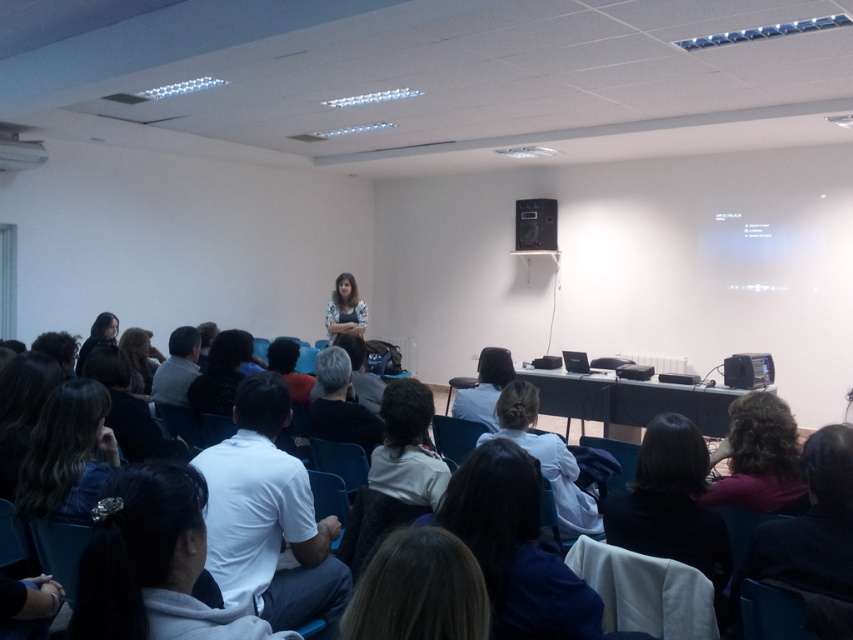
Question: Where is white matte shirt at center located in relation to gray fabric shirt at center in the image?

Choices:
 (A) below
 (B) above

Answer: (A)

Question: Which object appears farthest from the camera in this image?

Choices:
 (A) dark brown hair at lower right
 (B) smooth white shirt at center

Answer: (B)

Question: Does white cotton shirt at center appear over matte black jacket at left?

Choices:
 (A) no
 (B) yes

Answer: (A)

Question: Is gray fabric shirt at center wider than black plastic speaker at upper center?

Choices:
 (A) yes
 (B) no

Answer: (B)

Question: Which object is closer to the camera taking this photo?

Choices:
 (A) white fabric shirt at center
 (B) dark brown hair at lower left

Answer: (A)

Question: Which object appears closest to the camera in this image?

Choices:
 (A) dark gray fabric jacket at center
 (B) gray fabric shirt at center
 (C) white fabric at center

Answer: (C)